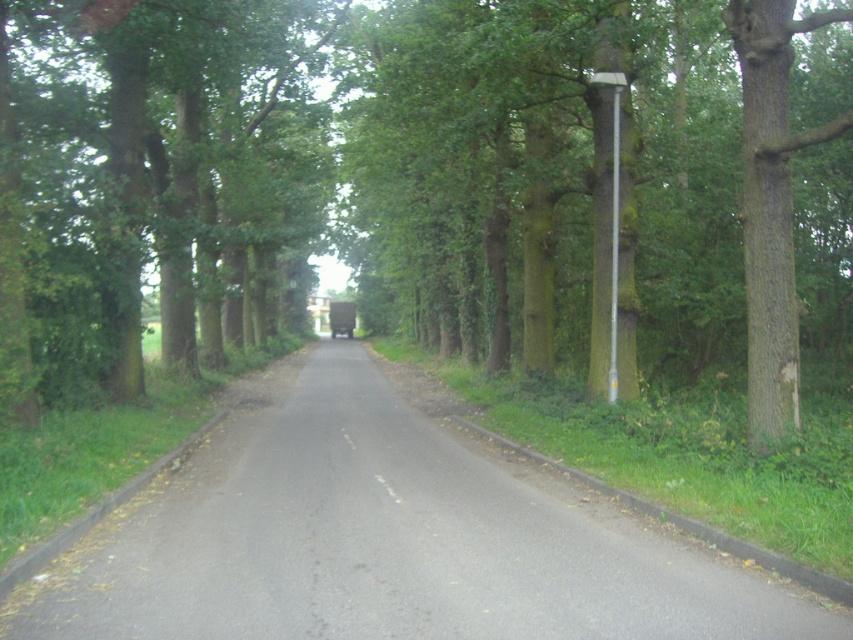
Question: Does green leafy tree at center appear on the right side of asphalt road at center?

Choices:
 (A) no
 (B) yes

Answer: (B)

Question: Estimate the real-world distances between objects in this image. Which object is closer to the metallic pole at right?

Choices:
 (A) asphalt road at center
 (B) green leafy tree at center

Answer: (A)

Question: Considering the relative positions of asphalt road at center and metallic pole at right in the image provided, where is asphalt road at center located with respect to metallic pole at right?

Choices:
 (A) left
 (B) right

Answer: (A)

Question: Does green leafy tree at center have a smaller size compared to asphalt road at center?

Choices:
 (A) no
 (B) yes

Answer: (A)

Question: Which point is farther to the camera?

Choices:
 (A) metallic pole at right
 (B) green leafy tree at center
 (C) asphalt road at center

Answer: (A)

Question: Which point is closer to the camera taking this photo?

Choices:
 (A) (287, 468)
 (B) (614, 228)
 (C) (27, 220)

Answer: (C)